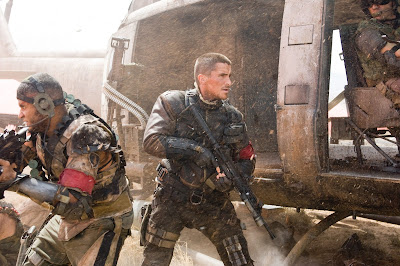
Find the location of a particular element. earphone is located at coordinates (41, 103).